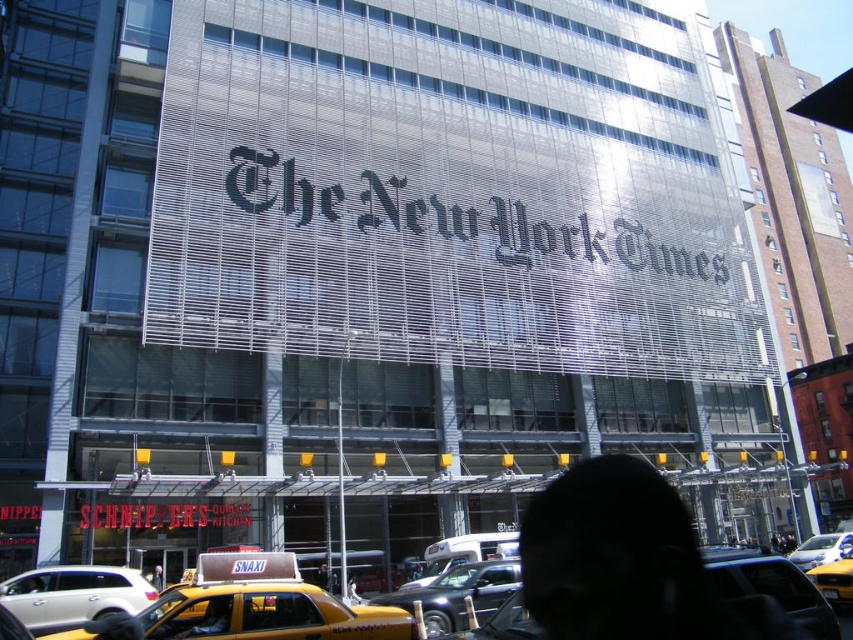
Question: Observing the image, what is the correct spatial positioning of yellow matte taxi at lower center in reference to yellow taxi cab at center?

Choices:
 (A) above
 (B) below

Answer: (A)

Question: Which object is positioned farthest from the yellow rubber taxi at center?

Choices:
 (A) yellow taxi cab at center
 (B) black hair at center
 (C) metallic silver car at center

Answer: (C)

Question: Which point is closer to the camera?

Choices:
 (A) metallic silver car at center
 (B) white glossy sedan at lower left
 (C) black hair at center

Answer: (C)

Question: Does yellow matte taxi at lower center have a larger size compared to yellow metallic taxi cab at center?

Choices:
 (A) no
 (B) yes

Answer: (B)

Question: Can you confirm if black hair at center is wider than yellow taxi cab at center?

Choices:
 (A) yes
 (B) no

Answer: (B)

Question: Which point appears farthest from the camera in this image?

Choices:
 (A) (16, 614)
 (B) (723, 620)
 (C) (505, 609)
 (D) (825, 554)

Answer: (D)